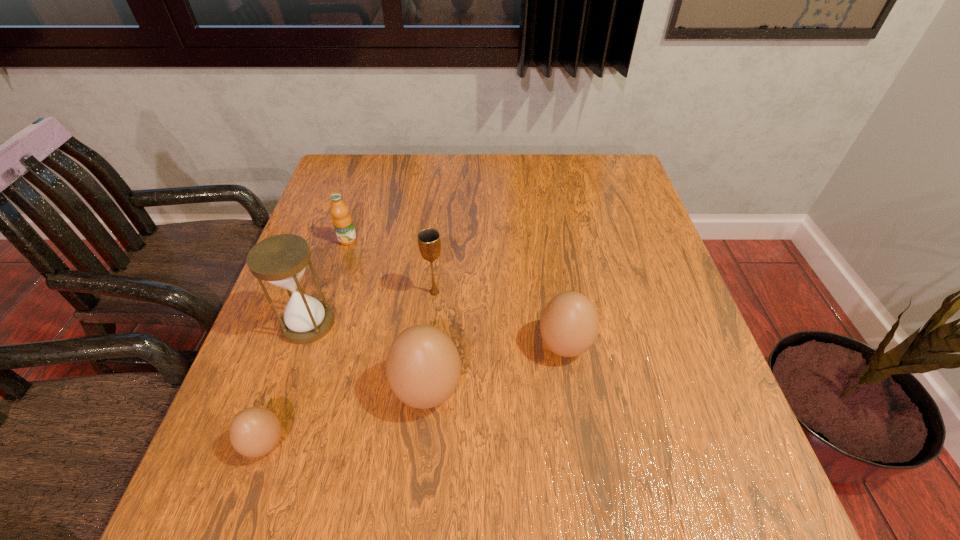
The width and height of the screenshot is (960, 540). I want to click on vacant area that lies between the rightmost object and the second farthest object, so click(499, 319).

Identify the location of free space between the hourglass and the farthest object. This screenshot has width=960, height=540. (328, 282).

Identify the location of vacant area that lies between the second boiled egg from left to right and the orange juice. This screenshot has height=540, width=960. (388, 315).

Where is `the second closest object relative to the rightmost boiled egg`? The image size is (960, 540). the second closest object relative to the rightmost boiled egg is located at coordinates (429, 242).

Where is `object that can be found as the third closest to the second boiled egg from right to left`? The height and width of the screenshot is (540, 960). object that can be found as the third closest to the second boiled egg from right to left is located at coordinates (429, 242).

Choose which boiled egg is the second nearest neighbor to the shortest boiled egg. Please provide its 2D coordinates. Your answer should be formatted as a tuple, i.e. [(x, y)], where the tuple contains the x and y coordinates of a point satisfying the conditions above.

[(569, 324)]

Where is `the second closest boiled egg relative to the second boiled egg from left to right`? the second closest boiled egg relative to the second boiled egg from left to right is located at coordinates (255, 431).

Find the location of a particular element. free region that satisfies the following two spatial constraints: 1. on the front side of the second boiled egg from right to left; 2. on the right side of the tallest object is located at coordinates pos(285,390).

You are a GUI agent. You are given a task and a screenshot of the screen. Output one action in this format:
    pyautogui.click(x=<x>, y=<y>)
    Task: Click on the vacant space that satisfies the following two spatial constraints: 1. on the front side of the chalice; 2. on the right side of the second boiled egg from right to left
    
    Given the screenshot: What is the action you would take?
    pyautogui.click(x=425, y=390)

Where is `free space that satisfies the following two spatial constraints: 1. on the label of the fifth nearest object; 2. on the right side of the farthest object`? This screenshot has width=960, height=540. free space that satisfies the following two spatial constraints: 1. on the label of the fifth nearest object; 2. on the right side of the farthest object is located at coordinates (331, 292).